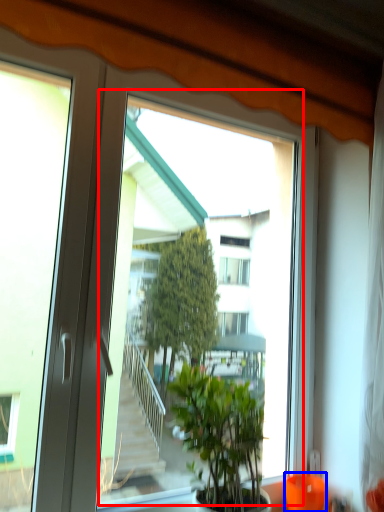
Question: Which point is further to the camera, window screen (highlighted by a red box) or glass vase (highlighted by a blue box)?

Choices:
 (A) window screen
 (B) glass vase

Answer: (B)